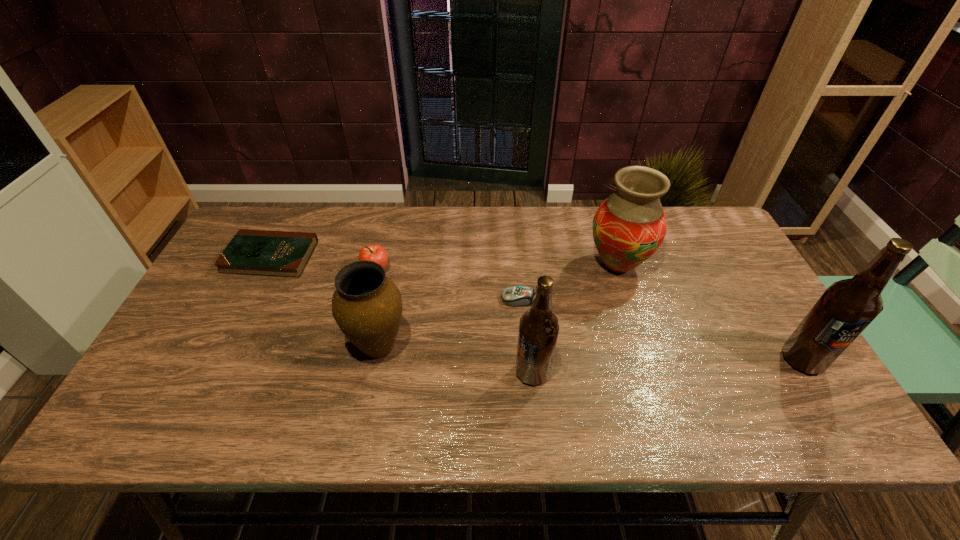
Find the location of `vacant space at the far right corner of the desktop`. vacant space at the far right corner of the desktop is located at coordinates (710, 210).

Find the location of a particular element. unoccupied position between the tallest object and the urn is located at coordinates (590, 354).

You are a GUI agent. You are given a task and a screenshot of the screen. Output one action in this format:
    pyautogui.click(x=<x>, y=<y>)
    Task: Click on the free spot between the shorter beer bottle and the sixth object from left to right
    This screenshot has width=960, height=540.
    Given the screenshot: What is the action you would take?
    pyautogui.click(x=575, y=319)

At what (x,y) coordinates should I click in order to perform the action: click on free space between the left beer bottle and the fourth shortest object. Please return your answer as a coordinate pair (x, y). Looking at the image, I should click on (455, 360).

Find the location of a particular element. blank region between the Bible and the fourth shortest object is located at coordinates (324, 302).

Where is `unoccupied position between the fourth tallest object and the leftmost object`? This screenshot has height=540, width=960. unoccupied position between the fourth tallest object and the leftmost object is located at coordinates (324, 302).

Image resolution: width=960 pixels, height=540 pixels. I want to click on vacant region between the leftmost object and the second object from right to left, so click(444, 261).

Locate an element on the screen. The height and width of the screenshot is (540, 960). free space between the shorter beer bottle and the third shortest object is located at coordinates (454, 322).

Point out which object is positioned as the nearest to the rightmost object. Please provide its 2D coordinates. Your answer should be formatted as a tuple, i.e. [(x, y)], where the tuple contains the x and y coordinates of a point satisfying the conditions above.

[(629, 226)]

Select which object appears as the fifth closest to the fourth tallest object. Please provide its 2D coordinates. Your answer should be formatted as a tuple, i.e. [(x, y)], where the tuple contains the x and y coordinates of a point satisfying the conditions above.

[(629, 226)]